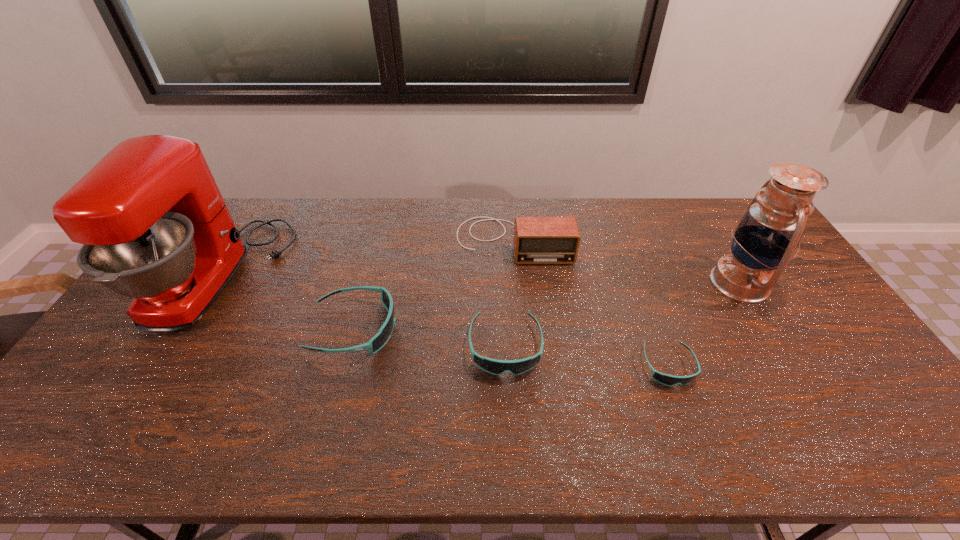
Identify the location of vacant space that is in between the shortest object and the second shortest object. The width and height of the screenshot is (960, 540). (587, 356).

I want to click on free area in between the oil lamp and the kitchen mixer, so click(x=481, y=280).

Find the location of a particular element. This screenshot has height=540, width=960. empty location between the second object from right to left and the second sunglasses from right to left is located at coordinates (587, 356).

Select which object appears as the second closest to the second object from left to right. Please provide its 2D coordinates. Your answer should be formatted as a tuple, i.e. [(x, y)], where the tuple contains the x and y coordinates of a point satisfying the conditions above.

[(497, 367)]

Select which object appears as the third closest to the kitchen mixer. Please provide its 2D coordinates. Your answer should be formatted as a tuple, i.e. [(x, y)], where the tuple contains the x and y coordinates of a point satisfying the conditions above.

[(497, 367)]

Identify which sunglasses is located as the nearest to the oil lamp. Please provide its 2D coordinates. Your answer should be formatted as a tuple, i.e. [(x, y)], where the tuple contains the x and y coordinates of a point satisfying the conditions above.

[(669, 380)]

Select which sunglasses appears as the closest to the oil lamp. Please provide its 2D coordinates. Your answer should be formatted as a tuple, i.e. [(x, y)], where the tuple contains the x and y coordinates of a point satisfying the conditions above.

[(669, 380)]

This screenshot has height=540, width=960. In order to click on vacant region that satisfies the following two spatial constraints: 1. on the front-facing side of the radio receiver; 2. on the front-facing side of the kitchen mixer in this screenshot , I will do `click(516, 277)`.

Locate an element on the screen. free spot that satisfies the following two spatial constraints: 1. on the front-facing side of the kitchen mixer; 2. on the left side of the rightmost object is located at coordinates (218, 283).

Locate an element on the screen. The image size is (960, 540). vacant position in the image that satisfies the following two spatial constraints: 1. on the front-facing side of the rightmost object; 2. on the left side of the leftmost object is located at coordinates (218, 283).